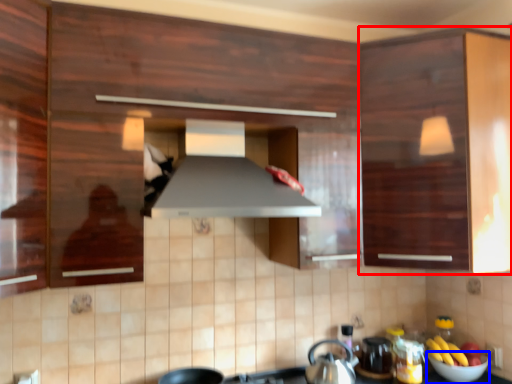
Question: Which of the following is the closest to the observer, cabinetry (highlighted by a red box) or bowl (highlighted by a blue box)?

Choices:
 (A) cabinetry
 (B) bowl

Answer: (A)